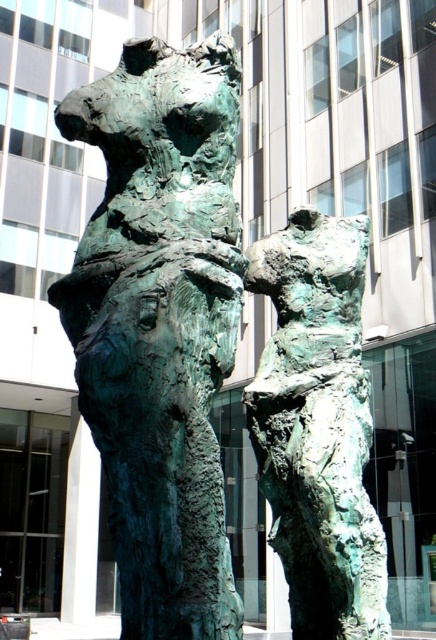
Consider the image. You are an art curator planning to display both the green patina sculpture at center and the green patina bronze statue at center in a gallery. Given their heights, which one should be placed on the lower shelf to ensure proper visibility for visitors?

The green patina sculpture at center should be placed on the lower shelf since it is shorter than the green patina bronze statue at center, allowing visitors to view both sculptures comfortably without obstruction.

You are an art curator planning to display both the green patina sculpture at center and the green patina bronze statue at center in a gallery. The gallery has a narrow corridor that can only accommodate items up to 2 meters in width. Which sculpture should you choose to display first in the corridor to ensure it fits without rearrangement?

The green patina bronze statue at center should be displayed first because its width is smaller than the green patina sculpture at center, ensuring it fits within the 2 meter width limit of the corridor.

You are an art curator planning to install a new light fixture between the green patina sculpture at center and the green patina bronze statue at center. Based on their positions, which sculpture should the light fixture be closer to if you want it to be equidistant from both?

The light fixture should be placed equidistant between the green patina sculpture at center and the green patina bronze statue at center. Since the green patina sculpture at center is to the left of the green patina bronze statue at center, the midpoint between them would naturally be closer to the bronze statue if they are not equally spaced. However, without specific distance measurements, the best approach is to center the light fixture exactly between both sculptures to ensure equal distance from both.